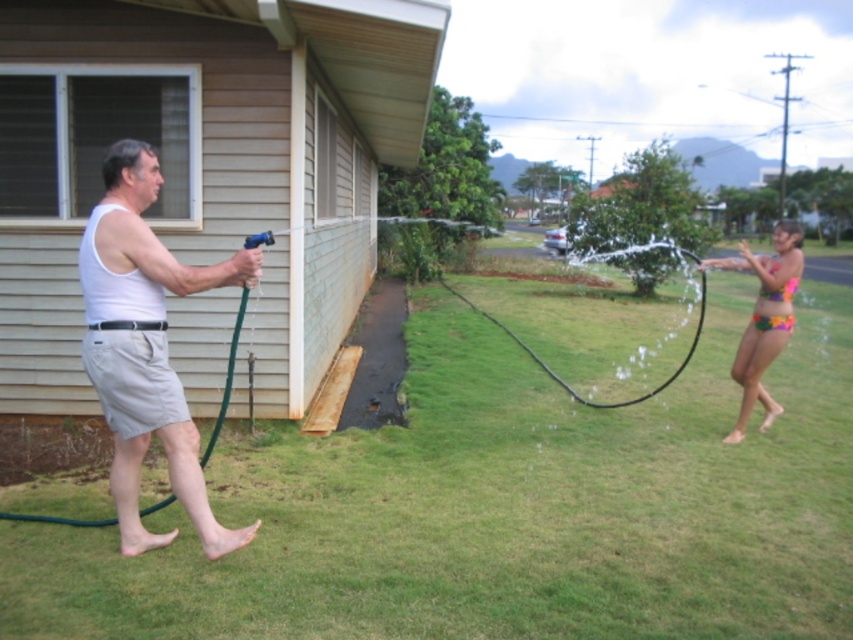
Question: Which object appears closest to the camera in this image?

Choices:
 (A) green grass at center
 (B) multicolored bikini at right
 (C) green rubber hose at left
 (D) white matte tank top at left

Answer: (A)

Question: Which object is positioned farthest from the multicolored fabric bikini top at right?

Choices:
 (A) green grass at center
 (B) green rubber hose at left

Answer: (B)

Question: Can you confirm if green grass at center is positioned to the left of multicolored fabric bikini top at right?

Choices:
 (A) yes
 (B) no

Answer: (A)

Question: Which object is closer to the camera taking this photo?

Choices:
 (A) green grass at center
 (B) multicolored fabric bikini top at right
 (C) multicolored bikini at right
 (D) green rubber hose at left

Answer: (A)

Question: Is white matte tank top at left to the right of green rubber hose at left from the viewer's perspective?

Choices:
 (A) no
 (B) yes

Answer: (B)

Question: Can you confirm if green grass at center is bigger than multicolored bikini at right?

Choices:
 (A) yes
 (B) no

Answer: (B)